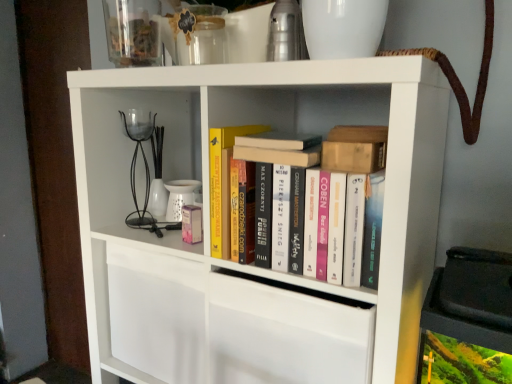
The height and width of the screenshot is (384, 512). What are the coordinates of `wooden block at upper right, the 2th book when ordered from bottom to top` in the screenshot? It's located at (355, 149).

This screenshot has width=512, height=384. I want to click on hardcover book at center, the 2th book positioned from the top, so click(280, 155).

What is the approximate width of hardcover books at center, the 4th book from the top?

hardcover books at center, the 4th book from the top, is 3.77 inches in width.

Image resolution: width=512 pixels, height=384 pixels. In order to click on white matte bookshelf at center in this screenshot , I will do `click(277, 129)`.

You are a GUI agent. You are given a task and a screenshot of the screen. Output one action in this format:
    pyautogui.click(x=<x>, y=<y>)
    Task: Click on the wooden block at upper right, the 2th book when ordered from bottom to top
    Image resolution: width=512 pixels, height=384 pixels.
    Given the screenshot: What is the action you would take?
    pyautogui.click(x=355, y=149)

Considering the sizes of white matte bookshelf at center and hardcover book at center, arranged as the fourth book when ordered from the bottom, in the image, is white matte bookshelf at center taller or shorter than hardcover book at center, arranged as the fourth book when ordered from the bottom,?

white matte bookshelf at center is taller than hardcover book at center, arranged as the fourth book when ordered from the bottom.

Which is closer to the camera, (131, 231) or (287, 133)?

Point (131, 231) is closer to the camera than point (287, 133).

Considering the positions of objects white matte bookshelf at center and hardcover book at center, arranged as the fourth book when ordered from the bottom, in the image provided, who is in front, white matte bookshelf at center or hardcover book at center, arranged as the fourth book when ordered from the bottom,?

white matte bookshelf at center is in front.

Relative to yellow hardcover book at center, is hardcover books at center, the 1th book from the bottom, in front or behind?

hardcover books at center, the 1th book from the bottom, is positioned closer to the viewer than yellow hardcover book at center.

From a real-world perspective, which is physically above, hardcover books at center, the 1th book from the bottom, or yellow hardcover book at center?

yellow hardcover book at center, from a real-world perspective.

Identify the location of paperback book above the hardcover books at center, the 4th book from the top (from a real-world perspective). (223, 183).

Considering the relative sizes of hardcover books at center, the 4th book from the top, and yellow hardcover book at center in the image provided, is hardcover books at center, the 4th book from the top, smaller than yellow hardcover book at center?

No.

Between transparent glass jar at upper center and yellow hardcover book at center, which one has larger size?

yellow hardcover book at center.

Consider the image. Does transparent glass jar at upper center turn towards yellow hardcover book at center?

No, transparent glass jar at upper center is not aimed at yellow hardcover book at center.

Considering the relative positions of transparent glass jar at upper center and yellow hardcover book at center in the image provided, is transparent glass jar at upper center to the right of yellow hardcover book at center from the viewer's perspective?

In fact, transparent glass jar at upper center is to the left of yellow hardcover book at center.

Where is `paperback book that is on the right side of transparent glass jar at upper center`? The width and height of the screenshot is (512, 384). paperback book that is on the right side of transparent glass jar at upper center is located at coordinates [x=223, y=183].

Considering the sizes of objects wooden block at upper right, which is the third book from top to bottom, and yellow hardcover book at center in the image provided, who is bigger, wooden block at upper right, which is the third book from top to bottom, or yellow hardcover book at center?

Bigger between the two is yellow hardcover book at center.

From a real-world perspective, which object stands above the other?

wooden block at upper right, the 2th book when ordered from bottom to top, from a real-world perspective.

How different are the orientations of wooden block at upper right, which is the third book from top to bottom, and yellow hardcover book at center in degrees?

The angular difference between wooden block at upper right, which is the third book from top to bottom, and yellow hardcover book at center is 0.00178 degrees.

How far apart are wooden block at upper right, the 2th book when ordered from bottom to top, and yellow hardcover book at center?

A distance of 8.87 inches exists between wooden block at upper right, the 2th book when ordered from bottom to top, and yellow hardcover book at center.

Consider the image. Is white matte bookshelf at center in front of wooden block at upper right, which is the third book from top to bottom?

Yes, the depth of white matte bookshelf at center is less than that of wooden block at upper right, which is the third book from top to bottom.

Is there a large distance between white matte bookshelf at center and wooden block at upper right, the 2th book when ordered from bottom to top?

No, there isn't a large distance between white matte bookshelf at center and wooden block at upper right, the 2th book when ordered from bottom to top.

Would you say white matte bookshelf at center is inside or outside wooden block at upper right, the 2th book when ordered from bottom to top?

white matte bookshelf at center is located beyond the bounds of wooden block at upper right, the 2th book when ordered from bottom to top.

At what (x,y) coordinates should I click in order to perform the action: click on shelf below the wooden block at upper right, which is the third book from top to bottom (from the image's perspective). Please return your answer as a coordinate pair (x, y). Image resolution: width=512 pixels, height=384 pixels. Looking at the image, I should click on (277, 129).

Which is behind, wooden block at upper right, the 2th book when ordered from bottom to top, or hardcover book at center, the 2th book positioned from the top?

Positioned behind is hardcover book at center, the 2th book positioned from the top.

How far apart are wooden block at upper right, the 2th book when ordered from bottom to top, and hardcover book at center, the 2th book positioned from the top?

The distance of wooden block at upper right, the 2th book when ordered from bottom to top, from hardcover book at center, the 2th book positioned from the top, is 2.67 inches.

Image resolution: width=512 pixels, height=384 pixels. There is a wooden block at upper right, which is the third book from top to bottom. Find the location of `the 1st book above it (from the image's perspective)`. the 1st book above it (from the image's perspective) is located at coordinates (280, 155).

Considering the positions of point (357, 138) and point (278, 150), is point (357, 138) closer or farther from the camera than point (278, 150)?

Point (357, 138) is positioned closer to the camera compared to point (278, 150).

Considering the points (140, 55) and (348, 147), which point is behind, point (140, 55) or point (348, 147)?

Point (140, 55)

Is transparent glass jar at upper center facing towards wooden block at upper right, which is the third book from top to bottom?

No.

Is transparent glass jar at upper center shorter than wooden block at upper right, the 2th book when ordered from bottom to top?

No.

What's the angular difference between transparent glass jar at upper center and wooden block at upper right, which is the third book from top to bottom,'s facing directions?

transparent glass jar at upper center and wooden block at upper right, which is the third book from top to bottom, are facing 1.11 degrees away from each other.

Image resolution: width=512 pixels, height=384 pixels. There is a white matte bookshelf at center. In order to click on the 4th book above it (from the image's perspective) in this screenshot , I will do `click(279, 140)`.

Identify the location of book below the yellow hardcover book at center (from a real-world perspective). The height and width of the screenshot is (384, 512). (319, 200).

Looking at the image, which one is located closer to yellow hardcover book at center, wooden block at upper right, the 2th book when ordered from bottom to top, or hardcover book at center, which ranks as the 1th book in top-to-bottom order?

hardcover book at center, which ranks as the 1th book in top-to-bottom order, is positioned closer to the anchor yellow hardcover book at center.

Estimate the real-world distances between objects in this image. Which object is closer to transparent glass jar at upper center, hardcover books at center, the 4th book from the top, or hardcover book at center, arranged as the fourth book when ordered from the bottom?

hardcover book at center, arranged as the fourth book when ordered from the bottom.

When comparing their distances from hardcover book at center, which ranks as the 1th book in top-to-bottom order, does yellow hardcover book at center or white matte bookshelf at center seem further?

white matte bookshelf at center is positioned further to the anchor hardcover book at center, which ranks as the 1th book in top-to-bottom order.

Looking at the image, which one is located further to hardcover book at center, arranged as the fourth book when ordered from the bottom, hardcover books at center, the 1th book from the bottom, or transparent glass jar at upper center?

transparent glass jar at upper center lies further to hardcover book at center, arranged as the fourth book when ordered from the bottom, than the other object.

Estimate the real-world distances between objects in this image. Which object is closer to yellow hardcover book at center, transparent glass jar at upper center or hardcover book at center, the 3th book in the bottom-to-top sequence?

Based on the image, hardcover book at center, the 3th book in the bottom-to-top sequence, appears to be nearer to yellow hardcover book at center.

Which object lies nearer to the anchor point yellow hardcover book at center, hardcover book at center, the 3th book in the bottom-to-top sequence, or hardcover books at center, the 1th book from the bottom?

Among the two, hardcover book at center, the 3th book in the bottom-to-top sequence, is located nearer to yellow hardcover book at center.

When comparing their distances from white matte bookshelf at center, does wooden block at upper right, which is the third book from top to bottom, or hardcover book at center, arranged as the fourth book when ordered from the bottom, seem closer?

hardcover book at center, arranged as the fourth book when ordered from the bottom.

When comparing their distances from wooden block at upper right, which is the third book from top to bottom, does hardcover book at center, which ranks as the 1th book in top-to-bottom order, or transparent glass jar at upper center seem further?

Based on the image, transparent glass jar at upper center appears to be further to wooden block at upper right, which is the third book from top to bottom.

Where is `paperback book that lies between transparent glass jar at upper center and white matte bookshelf at center from top to bottom`? Image resolution: width=512 pixels, height=384 pixels. paperback book that lies between transparent glass jar at upper center and white matte bookshelf at center from top to bottom is located at coordinates tap(223, 183).

Locate an element on the screen. This screenshot has height=384, width=512. paperback book between transparent glass jar at upper center and wooden block at upper right, which is the third book from top to bottom is located at coordinates (223, 183).

Identify the location of book between yellow hardcover book at center and white matte bookshelf at center vertically. (319, 200).

In order to click on paperback book that lies between transparent glass jar at upper center and hardcover books at center, the 4th book from the top, from top to bottom in this screenshot , I will do `click(223, 183)`.